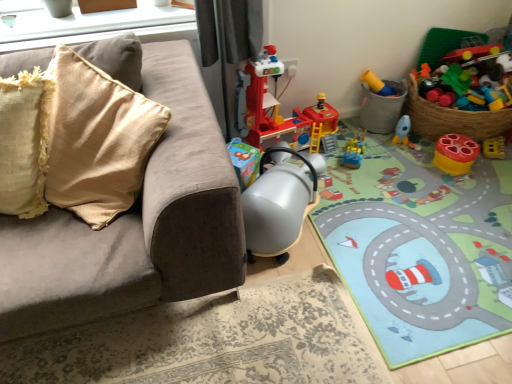
Image resolution: width=512 pixels, height=384 pixels. What are the coordinates of `vacant space situated on the left part of matte plastic toy at right, marked as the second toy in a right-to-left arrangement` in the screenshot? It's located at (417, 164).